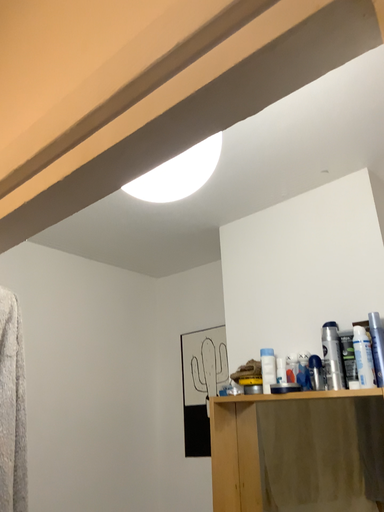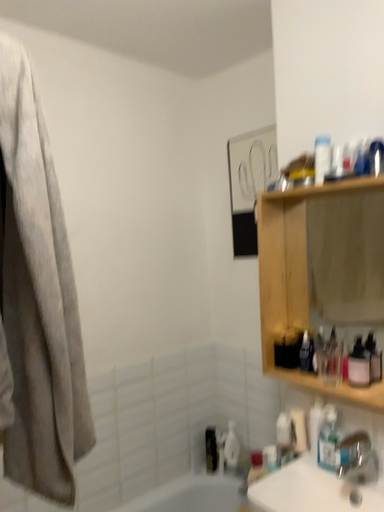
Question: How did the camera likely rotate when shooting the video?

Choices:
 (A) rotated downward
 (B) rotated upward

Answer: (A)